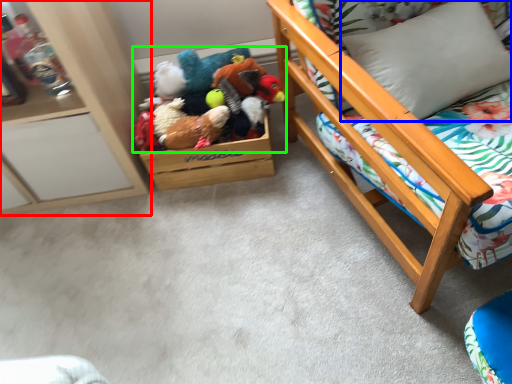
Question: Estimate the real-world distances between objects in this image. Which object is farther from furniture (highlighted by a red box), pillow (highlighted by a blue box) or toy (highlighted by a green box)?

Choices:
 (A) pillow
 (B) toy

Answer: (A)